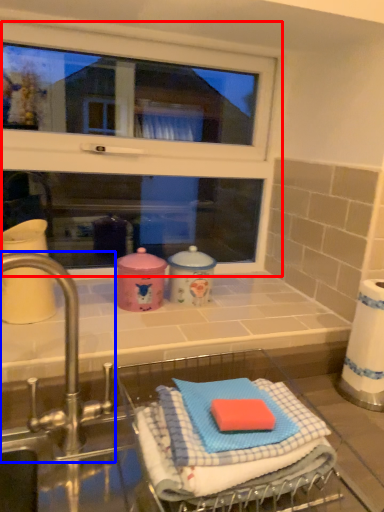
Question: Which of the following is the farthest to the observer, window (highlighted by a red box) or tap (highlighted by a blue box)?

Choices:
 (A) window
 (B) tap

Answer: (A)